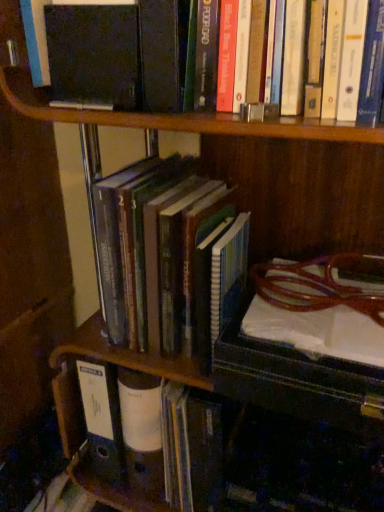
Question: Should I look upward or downward to see hardcover book at center, which is the second book from top to bottom?

Choices:
 (A) up
 (B) down

Answer: (B)

Question: Could you tell me if hardcover book at center, which ranks as the first book in bottom-to-top order, is facing hardcover books at center, the second book positioned from the bottom?

Choices:
 (A) yes
 (B) no

Answer: (B)

Question: Considering the relative sizes of hardcover book at center, which is the second book from top to bottom, and hardcover books at center, which is the 1th book in top-to-bottom order, in the image provided, is hardcover book at center, which is the second book from top to bottom, smaller than hardcover books at center, which is the 1th book in top-to-bottom order,?

Choices:
 (A) yes
 (B) no

Answer: (A)

Question: Considering the relative sizes of hardcover book at center, which is the second book from top to bottom, and hardcover books at center, the second book positioned from the bottom, in the image provided, is hardcover book at center, which is the second book from top to bottom, thinner than hardcover books at center, the second book positioned from the bottom,?

Choices:
 (A) yes
 (B) no

Answer: (B)

Question: Does hardcover book at center, which ranks as the first book in bottom-to-top order, appear on the left side of hardcover books at center, which is the 1th book in top-to-bottom order?

Choices:
 (A) yes
 (B) no

Answer: (A)

Question: From a real-world perspective, is hardcover book at center, which ranks as the first book in bottom-to-top order, positioned over hardcover books at center, the second book positioned from the bottom, based on gravity?

Choices:
 (A) yes
 (B) no

Answer: (B)

Question: From the image's perspective, is hardcover book at center, which ranks as the first book in bottom-to-top order, on top of hardcover books at center, the second book positioned from the bottom?

Choices:
 (A) yes
 (B) no

Answer: (B)

Question: Is hardcover book at center, which is the second book from top to bottom, surrounded by hardcover books at center, the second book positioned from the bottom?

Choices:
 (A) no
 (B) yes

Answer: (A)

Question: Is there a large distance between hardcover books at center, the second book positioned from the bottom, and hardcover book at center, which is the second book from top to bottom?

Choices:
 (A) yes
 (B) no

Answer: (B)

Question: Can you confirm if hardcover books at center, the second book positioned from the bottom, is shorter than hardcover book at center, which is the second book from top to bottom?

Choices:
 (A) no
 (B) yes

Answer: (A)

Question: From a real-world perspective, is hardcover books at center, the second book positioned from the bottom, on top of hardcover book at center, which is the second book from top to bottom?

Choices:
 (A) yes
 (B) no

Answer: (A)

Question: From the image's perspective, does hardcover books at center, the second book positioned from the bottom, appear higher than hardcover book at center, which is the second book from top to bottom?

Choices:
 (A) yes
 (B) no

Answer: (A)

Question: Is hardcover books at center, which is the 1th book in top-to-bottom order, behind hardcover book at center, which is the second book from top to bottom?

Choices:
 (A) no
 (B) yes

Answer: (A)

Question: Which is correct: hardcover book at center, which ranks as the first book in bottom-to-top order, is inside hardcover books at center, which is the 1th book in top-to-bottom order, or outside of it?

Choices:
 (A) outside
 (B) inside

Answer: (A)